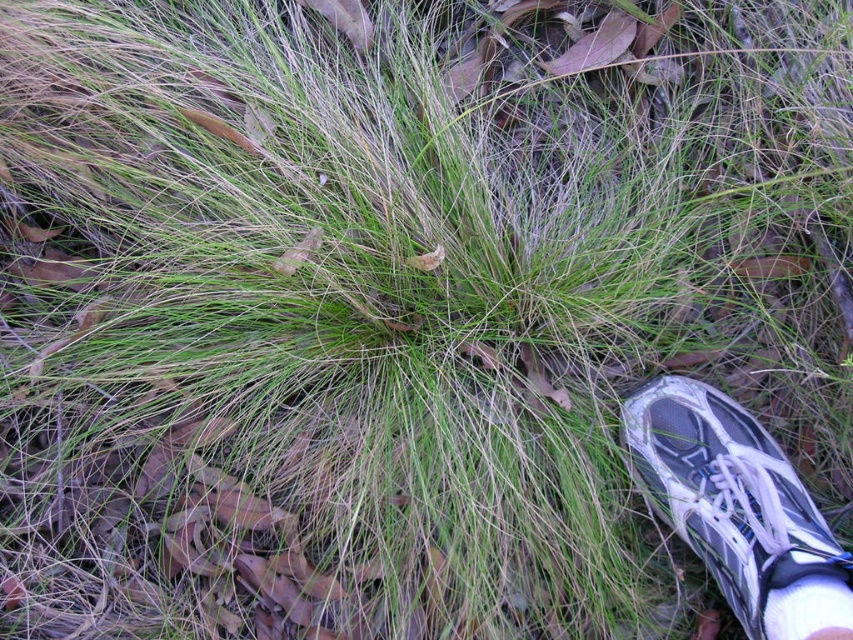
You are standing on the grass and see both the white mesh shoe at lower right and the white fabric sock at lower right. Which one is larger in size?

The white mesh shoe at lower right is bigger than the white fabric sock at lower right.

You are standing on the grass and see a white mesh shoe at lower right and a white fabric sock at lower right. Which one is closer to the left side of the image?

The white mesh shoe at lower right is closer to the left side of the image because it is to the left of the white fabric sock at lower right.